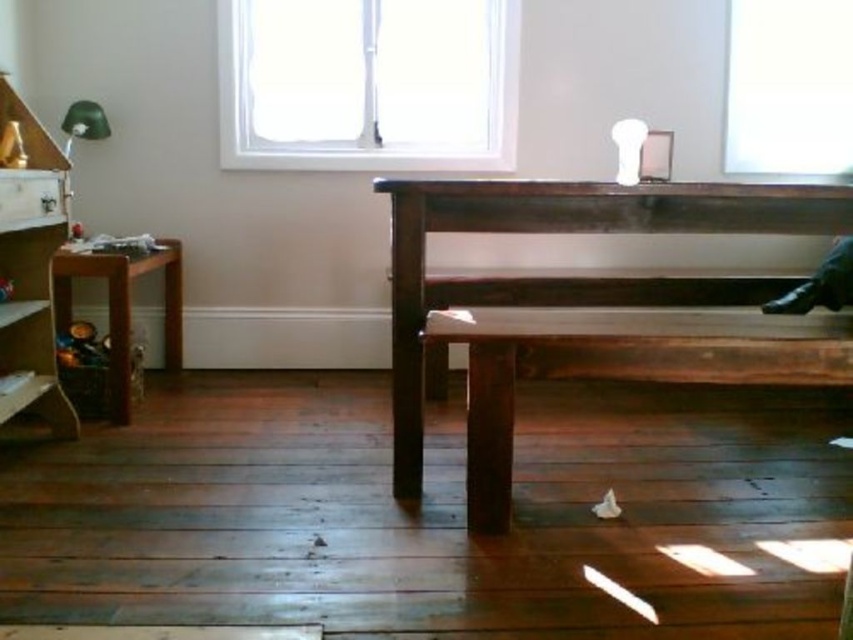
Question: Is dark brown wooden bench at center to the right of white glass window at upper center from the viewer's perspective?

Choices:
 (A) no
 (B) yes

Answer: (B)

Question: Considering the relative positions of white glass window at upper center and wooden stool at left in the image provided, where is white glass window at upper center located with respect to wooden stool at left?

Choices:
 (A) right
 (B) left

Answer: (A)

Question: Which object is closer to the camera taking this photo?

Choices:
 (A) wooden bookshelf at left
 (B) dark brown wooden bench at center
 (C) white glass window at upper center

Answer: (B)

Question: Which point is farther from the camera taking this photo?

Choices:
 (A) (39, 150)
 (B) (757, 96)
 (C) (357, 44)

Answer: (B)

Question: Which object is closer to the camera taking this photo?

Choices:
 (A) wooden bookshelf at left
 (B) dark brown wooden bench at center
 (C) white glass window at upper center

Answer: (B)

Question: Does dark brown wooden bench at center appear over wooden bookshelf at left?

Choices:
 (A) yes
 (B) no

Answer: (B)